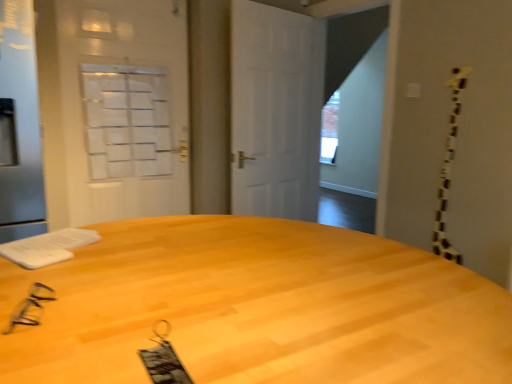
Question: From a real-world perspective, is silver metallic screen door at left, which is the 1th screen door in front-to-back order, above or below white frosted glass screen door at upper left, which ranks as the 1th screen door in back-to-front order?

Choices:
 (A) above
 (B) below

Answer: (B)

Question: Is point (27, 233) positioned closer to the camera than point (98, 127)?

Choices:
 (A) farther
 (B) closer

Answer: (B)

Question: Estimate the real-world distances between objects in this image. Which object is closer to the silver metallic screen door at left, which is the 1th screen door in front-to-back order?

Choices:
 (A) white frosted glass screen door at upper left, which ranks as the 1th screen door in back-to-front order
 (B) black plastic glasses at lower left
 (C) light wood desk at center
 (D) white matte door at center

Answer: (A)

Question: Considering the real-world distances, which object is closest to the black plastic glasses at lower left?

Choices:
 (A) white matte door at center
 (B) light wood desk at center
 (C) white frosted glass screen door at upper left, which ranks as the 1th screen door in back-to-front order
 (D) silver metallic screen door at left, which is the second screen door in back-to-front order

Answer: (B)